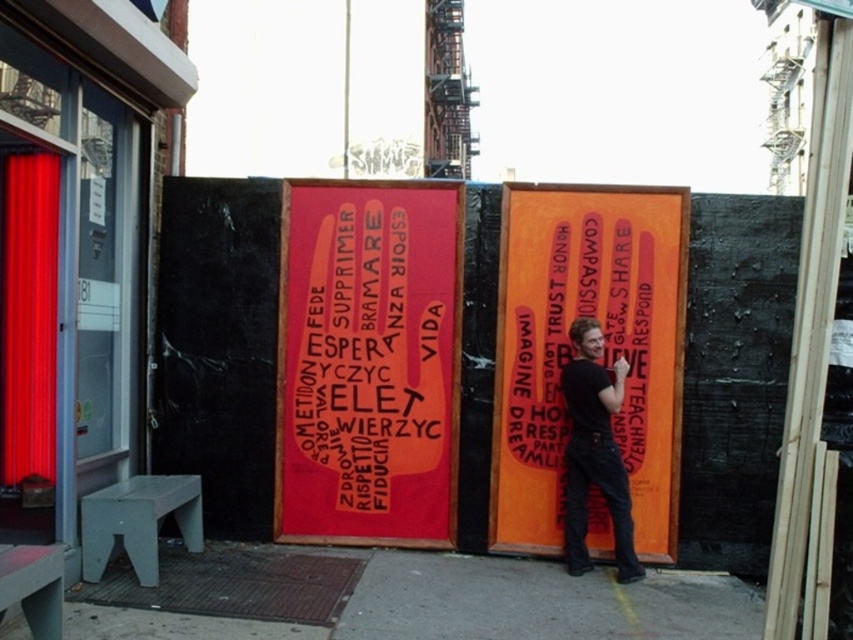
Question: Among these objects, which one is farthest from the camera?

Choices:
 (A) denim jeans at center
 (B) concrete at center
 (C) matte pink text at center

Answer: (C)

Question: Is concrete at center to the left of denim jeans at center from the viewer's perspective?

Choices:
 (A) no
 (B) yes

Answer: (B)

Question: Which of these objects is positioned farthest from the matte pink text at center?

Choices:
 (A) orange matte sign at center
 (B) denim jeans at center
 (C) concrete at center

Answer: (C)

Question: Does concrete at center have a larger size compared to denim jeans at center?

Choices:
 (A) no
 (B) yes

Answer: (B)

Question: Which object is positioned closest to the concrete at center?

Choices:
 (A) denim jeans at center
 (B) matte pink text at center
 (C) orange matte sign at center

Answer: (A)

Question: Can you confirm if matte pink text at center is positioned above concrete at center?

Choices:
 (A) yes
 (B) no

Answer: (A)